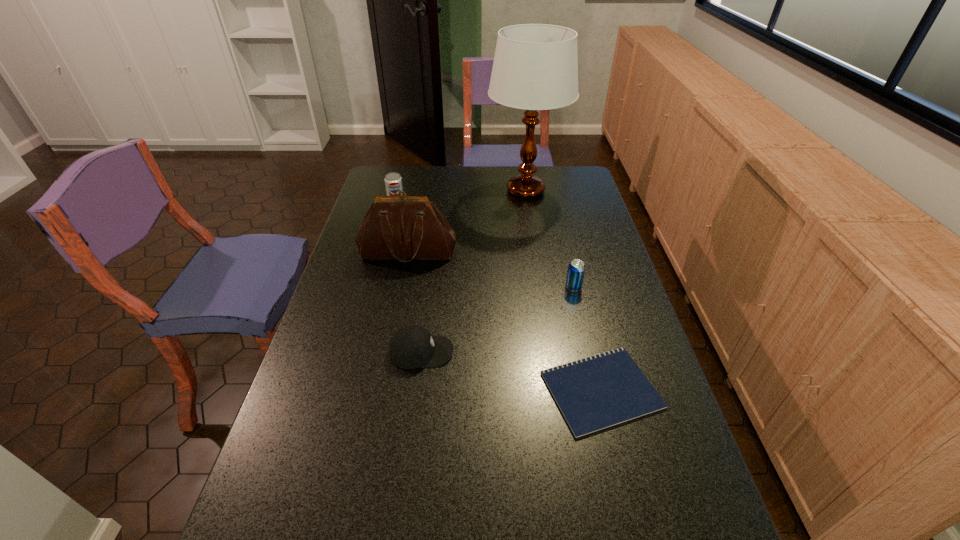
This screenshot has height=540, width=960. Identify the location of free region that satisfies the following two spatial constraints: 1. on the front side of the beer can; 2. on the front-facing side of the fifth tallest object. pyautogui.click(x=588, y=352).

At what (x,y) coordinates should I click in order to perform the action: click on vacant area that satisfies the following two spatial constraints: 1. on the front side of the fourth farthest object; 2. on the right side of the tallest object. Please return your answer as a coordinate pair (x, y). Image resolution: width=960 pixels, height=540 pixels. Looking at the image, I should click on (540, 287).

Where is `free space that satisfies the following two spatial constraints: 1. on the front side of the third nearest object; 2. on the left side of the soda`? This screenshot has height=540, width=960. free space that satisfies the following two spatial constraints: 1. on the front side of the third nearest object; 2. on the left side of the soda is located at coordinates (374, 287).